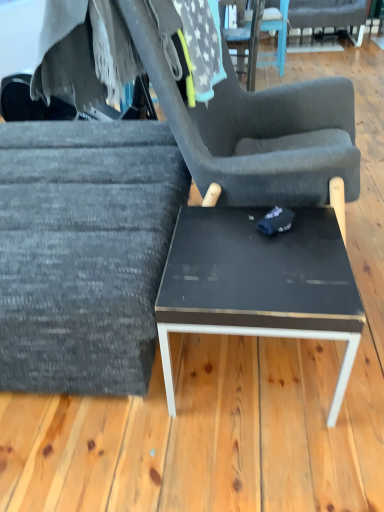
Question: From the image's perspective, is textured gray fabric chair at center, the second chair from the bottom, positioned above or below fuzzy gray blanket at upper left?

Choices:
 (A) below
 (B) above

Answer: (A)

Question: Considering their positions, is textured gray fabric chair at center, positioned as the 2th chair in front-to-back order, located in front of or behind fuzzy gray blanket at upper left?

Choices:
 (A) front
 (B) behind

Answer: (A)

Question: Based on their relative distances, which object is nearer to the textured gray fabric chair at left, the 1th chair when ordered from bottom to top?

Choices:
 (A) fuzzy gray blanket at upper left
 (B) textured gray fabric chair at center, the second chair from the bottom
 (C) dark gray fabric chair at upper right, the third chair positioned from the bottom
 (D) black glossy table at center

Answer: (D)

Question: Which object is positioned closest to the textured gray fabric chair at center, the second chair from the bottom?

Choices:
 (A) black glossy table at center
 (B) dark gray fabric chair at upper right, the third chair positioned from the bottom
 (C) textured gray fabric chair at left, which is counted as the third chair, starting from the back
 (D) fuzzy gray blanket at upper left

Answer: (A)